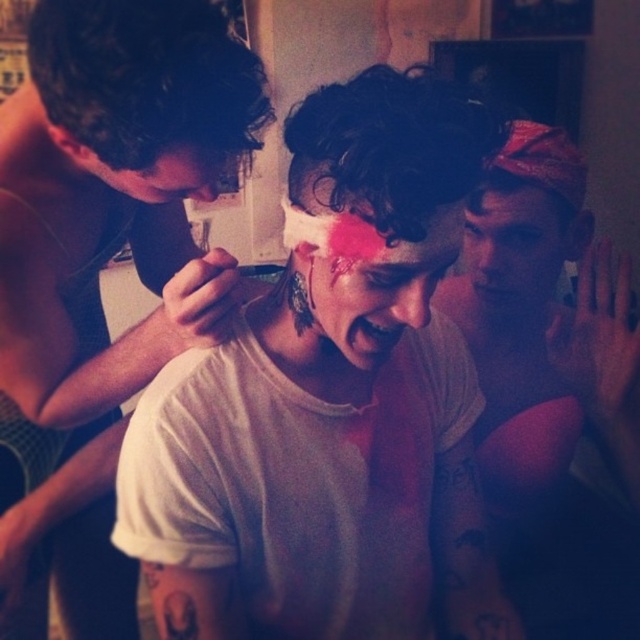
You are an interior designer assessing a room with a white matte bandana at upper right and a matte pink paint at center. Which object is positioned higher up in the room?

The white matte bandana at upper right is positioned higher up in the room than the matte pink paint at center.